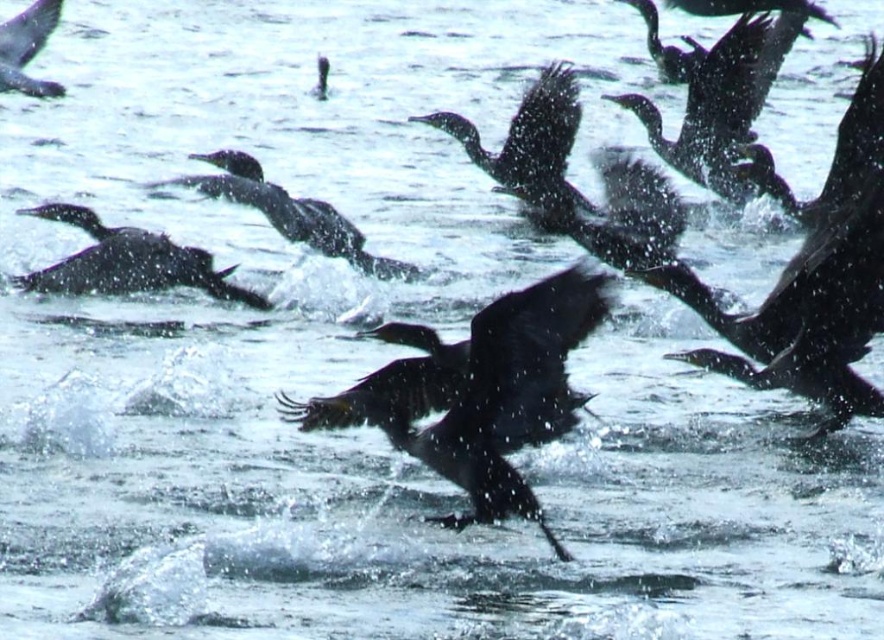
Question: Does shiny black bird at center have a greater width compared to shiny black bird at left?

Choices:
 (A) yes
 (B) no

Answer: (B)

Question: Which of the following is the farthest from the observer?

Choices:
 (A) shiny black bird at upper left
 (B) shiny black bird at left

Answer: (A)

Question: Where is shiny black bird at left located in relation to shiny black bird at upper left in the image?

Choices:
 (A) left
 (B) right

Answer: (B)

Question: Which point appears farthest from the camera in this image?

Choices:
 (A) (439, 458)
 (B) (208, 273)

Answer: (B)

Question: From the image, what is the correct spatial relationship of shiny black bird at center in relation to shiny black bird at left?

Choices:
 (A) right
 (B) left

Answer: (A)

Question: Among these points, which one is nearest to the camera?

Choices:
 (A) (67, 291)
 (B) (433, 461)

Answer: (B)